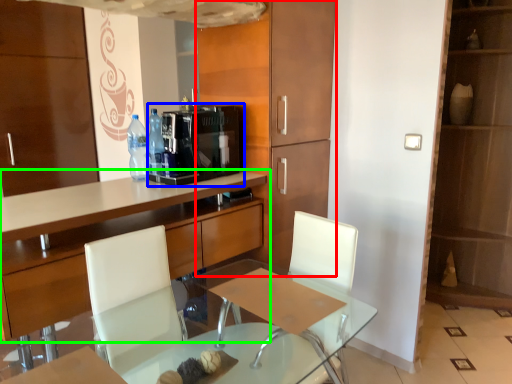
Question: Considering the real-world distances, which object is farthest from cabinetry (highlighted by a red box)? coffee machine (highlighted by a blue box) or cabinetry (highlighted by a green box)?

Choices:
 (A) coffee machine
 (B) cabinetry

Answer: (B)